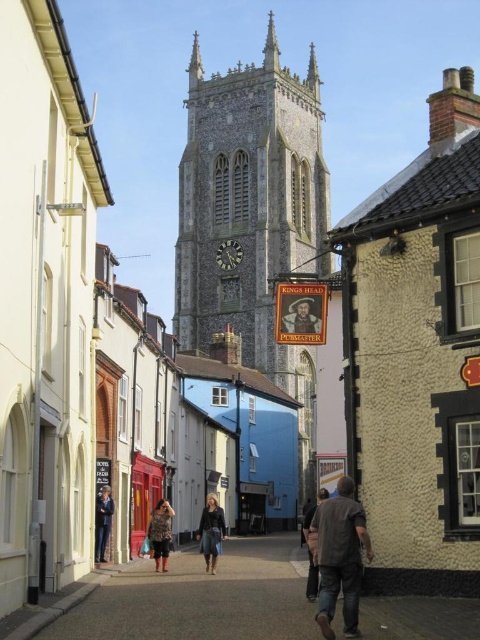
Is smooth concrete pavement at center wider than wooden signboard at center?

Indeed, smooth concrete pavement at center has a greater width compared to wooden signboard at center.

This screenshot has width=480, height=640. In order to click on smooth concrete pavement at center in this screenshot , I will do `click(201, 598)`.

Locate an element on the screen. smooth concrete pavement at center is located at coordinates (201, 598).

At what (x,y) coordinates should I click in order to perform the action: click on smooth concrete pavement at center. Please return your answer as a coordinate pair (x, y). The height and width of the screenshot is (640, 480). Looking at the image, I should click on pyautogui.click(x=201, y=598).

Does leather jacket at center appear on the left side of dark brown leather jacket at center?

Yes, leather jacket at center is to the left of dark brown leather jacket at center.

Can you confirm if leather jacket at center is positioned above dark brown leather jacket at center?

Indeed, leather jacket at center is positioned over dark brown leather jacket at center.

You are a GUI agent. You are given a task and a screenshot of the screen. Output one action in this format:
    pyautogui.click(x=<x>, y=<y>)
    Task: Click on the leather jacket at center
    
    Given the screenshot: What is the action you would take?
    pyautogui.click(x=160, y=532)

Does leather jacket at center have a lesser height compared to wooden signboard at center?

Yes.

Between leather jacket at center and wooden signboard at center, which one appears on the left side from the viewer's perspective?

leather jacket at center

Does point (167, 525) come behind point (299, 320)?

Yes, it is behind point (299, 320).

I want to click on leather jacket at center, so (160, 532).